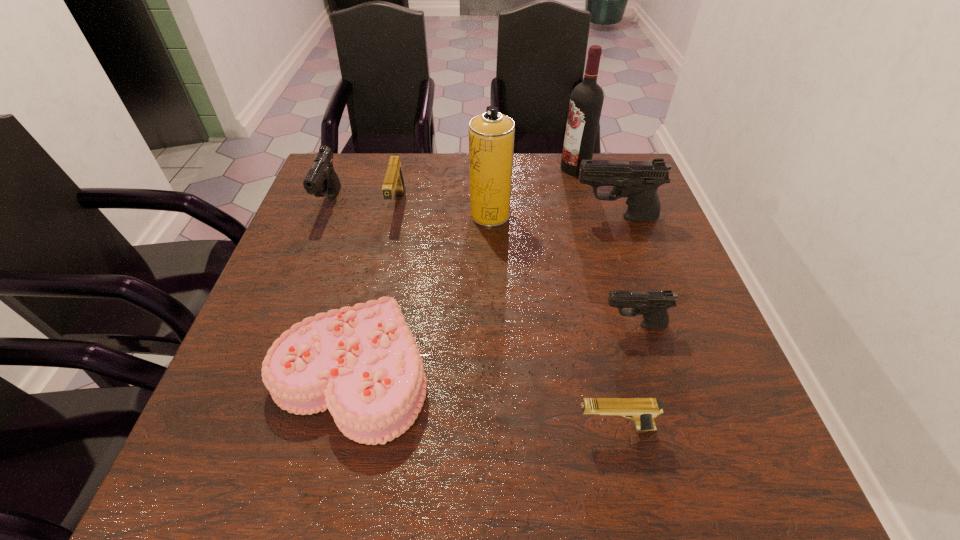
Image resolution: width=960 pixels, height=540 pixels. I want to click on wine bottle, so click(586, 101).

At what (x,y) coordinates should I click in order to perform the action: click on the fifth object from right to left. Please return your answer as a coordinate pair (x, y). The image size is (960, 540). Looking at the image, I should click on (491, 134).

You are a GUI agent. You are given a task and a screenshot of the screen. Output one action in this format:
    pyautogui.click(x=<x>, y=<y>)
    Task: Click on the aerosol can
    
    Given the screenshot: What is the action you would take?
    pyautogui.click(x=491, y=134)

Where is `the tallest pistol`? The width and height of the screenshot is (960, 540). the tallest pistol is located at coordinates (638, 180).

Find the location of a particular element. the biggest black pistol is located at coordinates (638, 180).

I want to click on the leftmost object, so click(321, 178).

Image resolution: width=960 pixels, height=540 pixels. I want to click on the leftmost black pistol, so click(321, 178).

What are the coordinates of `the bigger tan pistol` in the screenshot? It's located at (394, 181).

Locate an element on the screen. The height and width of the screenshot is (540, 960). the farther tan pistol is located at coordinates (394, 181).

I want to click on the nearest black pistol, so pos(653,305).